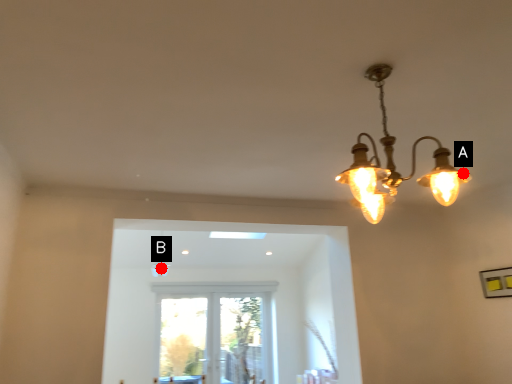
Question: Two points are circled on the image, labeled by A and B beside each circle. Among these points, which one is farthest from the camera?

Choices:
 (A) A is further
 (B) B is further

Answer: (B)